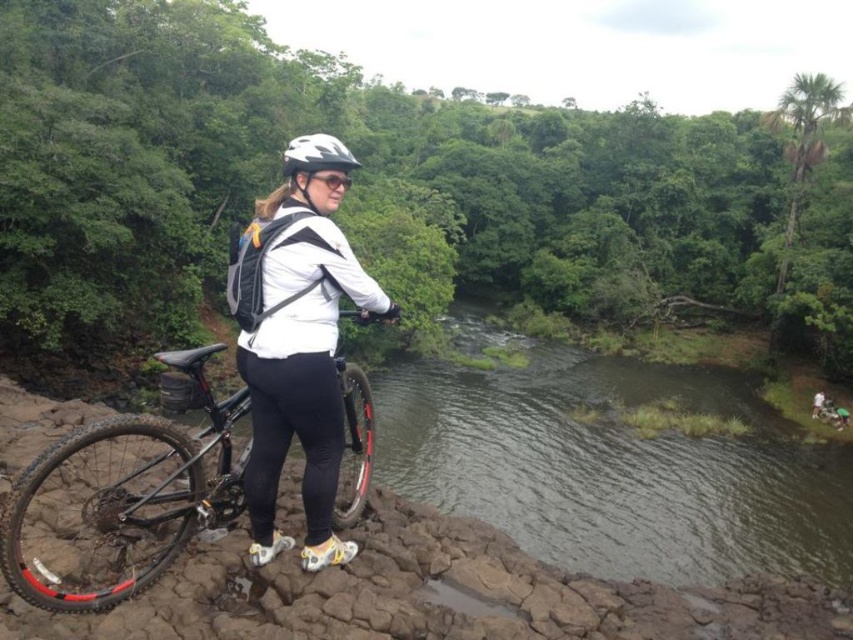
Is black matte bicycle at center further to camera compared to white matte bicycle helmet at center?

Yes, it is.

Describe the element at coordinates (134, 492) in the screenshot. I see `black matte bicycle at center` at that location.

Find the location of `black matte bicycle at center`. black matte bicycle at center is located at coordinates (134, 492).

How much distance is there between white matte jacket at center and black matte bicycle at center?

36.70 inches

Between point (329, 513) and point (131, 477), which one is positioned behind?

Point (329, 513)

Find the location of `white matte jacket at center`. white matte jacket at center is located at coordinates (297, 340).

Between white matte jacket at center and white matte bicycle helmet at center, which one has less height?

white matte jacket at center

Does white matte jacket at center appear over white matte bicycle helmet at center?

No.

Between point (315, 240) and point (312, 140), which one is positioned in front?

Positioned in front is point (315, 240).

This screenshot has width=853, height=640. In order to click on white matte jacket at center in this screenshot , I will do `click(297, 340)`.